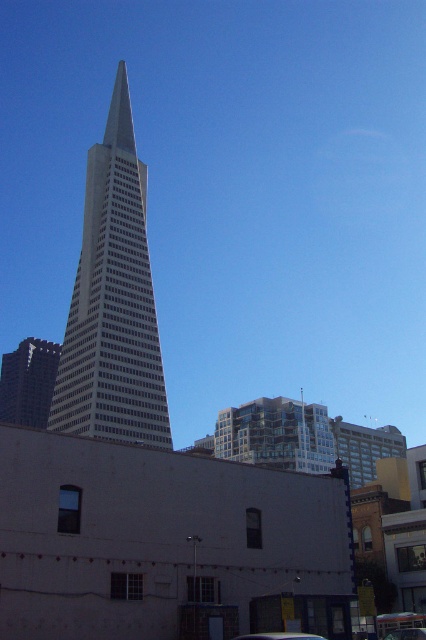
Question: Which object is closer to the camera taking this photo?

Choices:
 (A) glassy steel skyscraper at center
 (B) metallic silver car at center

Answer: (B)

Question: Among these points, which one is nearest to the camera?

Choices:
 (A) (60, 424)
 (B) (270, 636)

Answer: (B)

Question: Among these points, which one is nearest to the camera?

Choices:
 (A) (97, 401)
 (B) (411, 628)

Answer: (B)

Question: Does glassy steel skyscraper at center have a smaller size compared to metallic silver car at lower center?

Choices:
 (A) no
 (B) yes

Answer: (A)

Question: Can you confirm if glassy steel skyscraper at center is bigger than metallic silver car at center?

Choices:
 (A) no
 (B) yes

Answer: (B)

Question: Does glassy steel skyscraper at center come in front of metallic silver car at center?

Choices:
 (A) no
 (B) yes

Answer: (A)